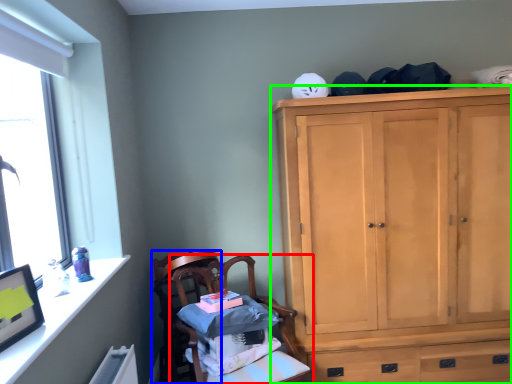
Question: Which is farther away from chair (highlighted by a red box)? chair (highlighted by a blue box) or cabinetry (highlighted by a green box)?

Choices:
 (A) chair
 (B) cabinetry

Answer: (B)